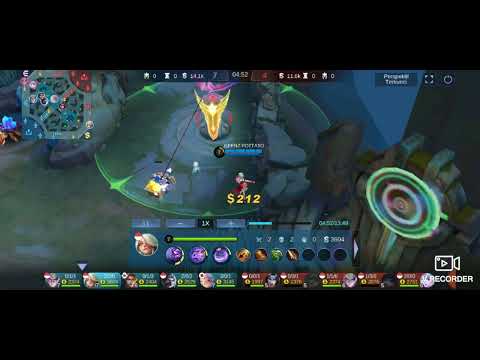
This screenshot has height=360, width=480. In order to click on map in this screenshot , I will do `click(60, 87)`.